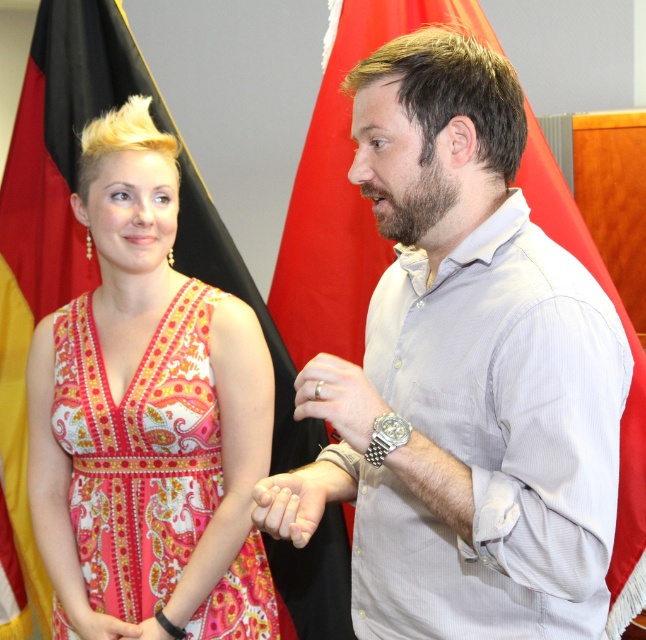
You are a fashion designer observing the scene. You need to determine the spatial relationship between the printed fabric dress at center and the black leather watch at center. Which one is positioned higher?

The printed fabric dress at center is above the black leather watch at center, so the printed fabric dress at center is positioned higher.

You are a tailor measuring fabrics for a project. You need to determine which object is shorter between the gray fabric shirt at center and the black fabric flag at upper left. Which one is shorter?

The gray fabric shirt at center has a lesser height compared to the black fabric flag at upper left, so the gray fabric shirt at center is shorter.